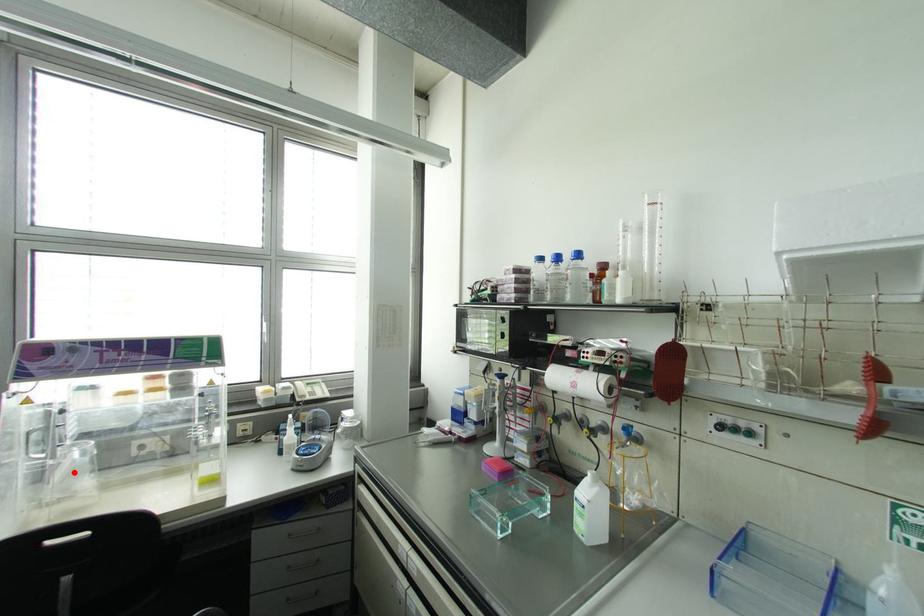
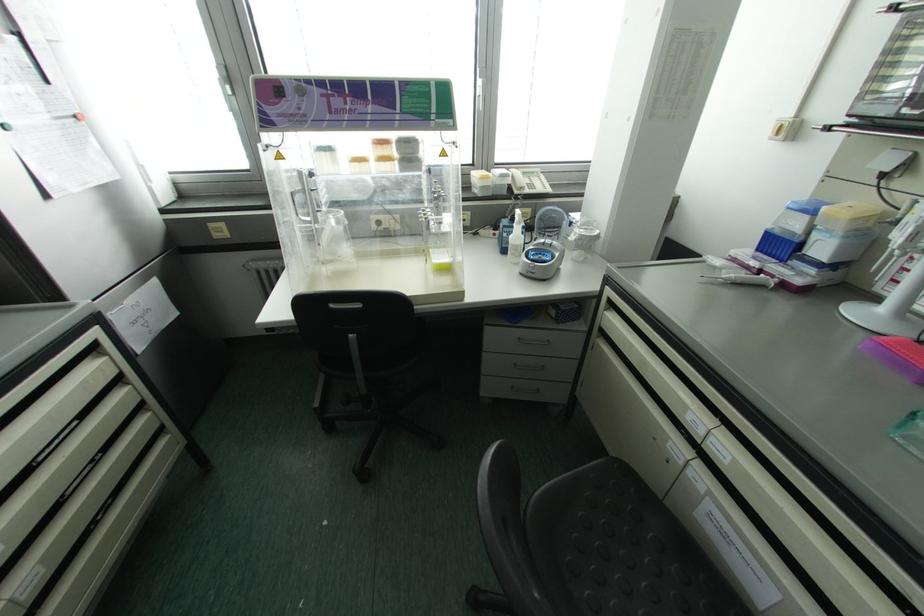
Find the pixel in the second image that matches the highlighted location in the first image.

(334, 238)